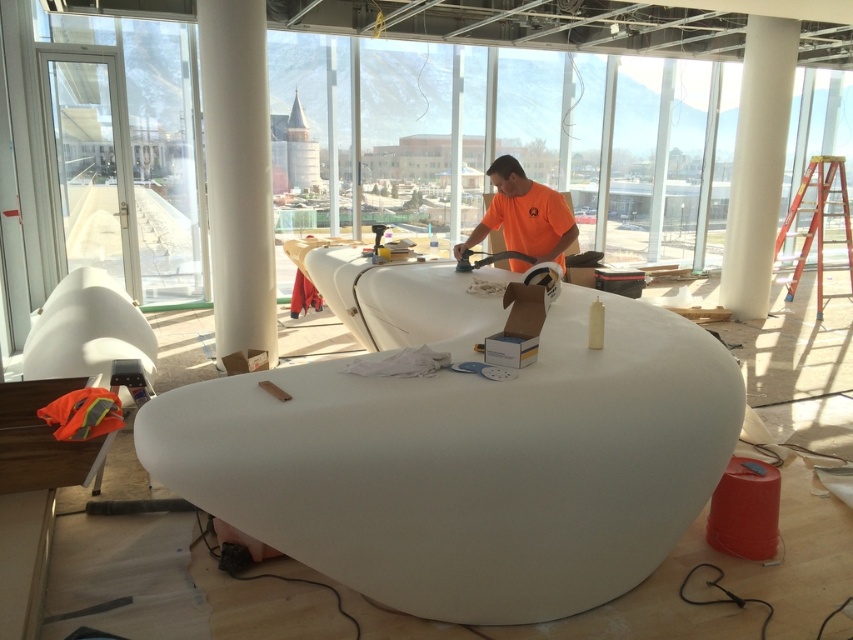
You are an inspector standing at the entrance of the construction site. You see the white smooth pillar at center and the orange matte shirt at center. Which object is closer to you?

The white smooth pillar at center is closer to you because the orange matte shirt at center is behind it.

You are an inspector checking the construction site. You notice the white smooth pillar at center and the orange matte shirt at center. Which object is taller?

The white smooth pillar at center is much taller than the orange matte shirt at center.

You are an inspector checking the construction site. You notice the white smooth pillar at center and the orange matte shirt at center. Which object is wider?

The orange matte shirt at center is wider than the white smooth pillar at center.